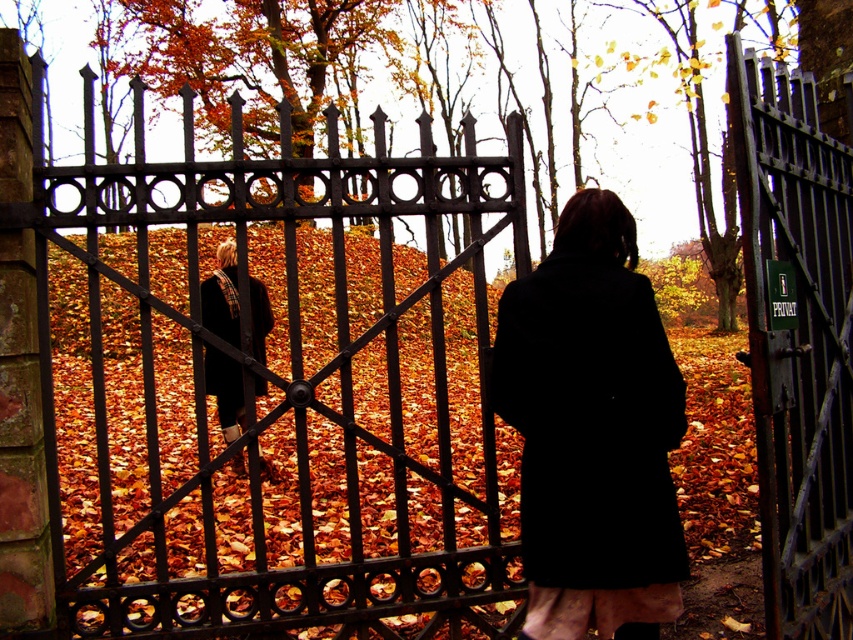
Question: Can you confirm if black matte coat at center is positioned to the left of black wool coat at center?

Choices:
 (A) yes
 (B) no

Answer: (B)

Question: Is black matte coat at center bigger than black wool coat at center?

Choices:
 (A) no
 (B) yes

Answer: (A)

Question: Among these points, which one is nearest to the camera?

Choices:
 (A) (235, 364)
 (B) (113, 186)
 (C) (556, 260)
 (D) (741, 92)

Answer: (D)

Question: Based on their relative distances, which object is farther from the dark iron gate at right?

Choices:
 (A) black matte coat at center
 (B) black wrought iron gate at center
 (C) black wool coat at center

Answer: (B)

Question: Is dark iron gate at right bigger than black wool coat at center?

Choices:
 (A) yes
 (B) no

Answer: (A)

Question: Among these objects, which one is farthest from the camera?

Choices:
 (A) black matte coat at center
 (B) black wrought iron gate at center

Answer: (B)